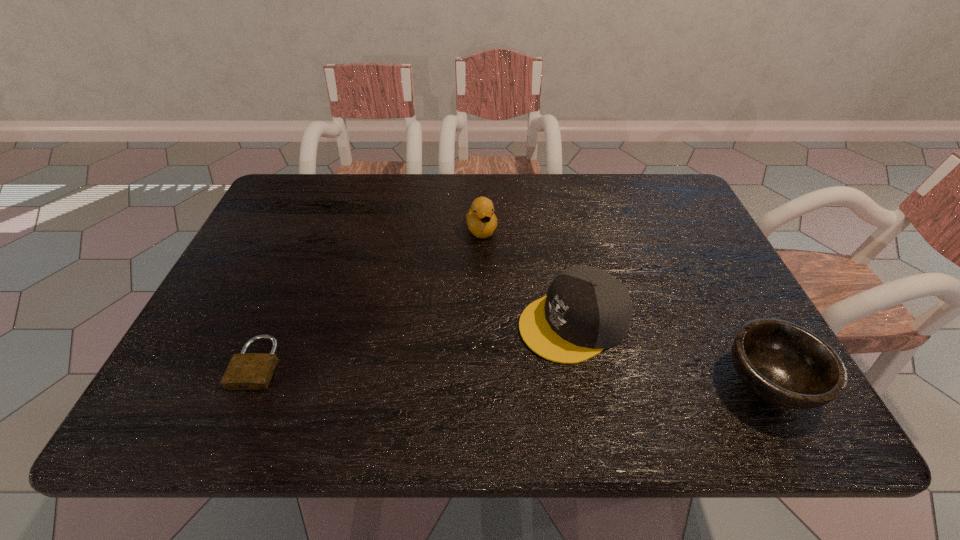
The height and width of the screenshot is (540, 960). I want to click on the leftmost object, so click(246, 371).

The width and height of the screenshot is (960, 540). I want to click on the shortest object, so click(246, 371).

Where is `the rightmost object`? This screenshot has width=960, height=540. the rightmost object is located at coordinates (785, 364).

Locate an element on the screen. This screenshot has width=960, height=540. the third tallest object is located at coordinates (785, 364).

Where is `duckling`? This screenshot has height=540, width=960. duckling is located at coordinates (481, 220).

Locate an element on the screen. the farthest object is located at coordinates (481, 220).

At what (x,y) coordinates should I click in order to perform the action: click on cap. Please return your answer as a coordinate pair (x, y). This screenshot has width=960, height=540. Looking at the image, I should click on (586, 310).

At what (x,y) coordinates should I click in order to perform the action: click on free space located on the left of the rightmost object. Please return your answer as a coordinate pair (x, y). This screenshot has height=540, width=960. Looking at the image, I should click on (608, 382).

Identify the location of free space located 0.190m on the face of the duckling. (499, 296).

Locate an element on the screen. vacant space located 0.100m on the face of the duckling is located at coordinates 492,270.